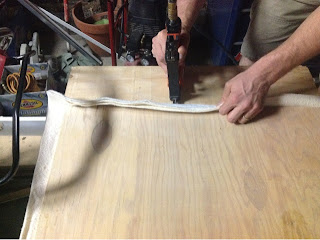
This screenshot has width=320, height=240. In order to click on brown clay pot in this screenshot , I will do `click(104, 31)`.